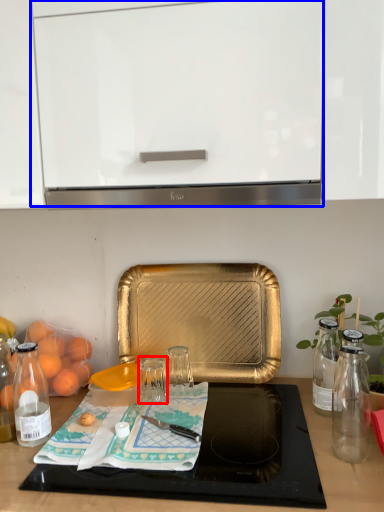
Question: Which object appears closest to the camera in this image, glass jar (highlighted by a red box) or cabinetry (highlighted by a blue box)?

Choices:
 (A) glass jar
 (B) cabinetry

Answer: (B)